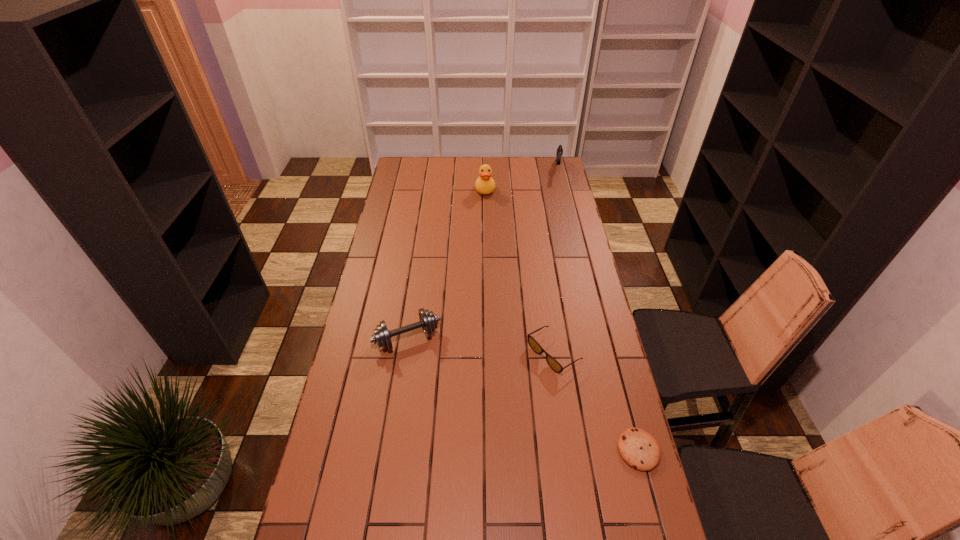
You are a GUI agent. You are given a task and a screenshot of the screen. Output one action in this format:
    pyautogui.click(x=<x>, y=<y>)
    Task: Click on the object that is at the far edge
    This screenshot has width=960, height=540.
    Given the screenshot: What is the action you would take?
    pyautogui.click(x=559, y=153)

Identify the location of object that is at the left edge. This screenshot has width=960, height=540. tap(428, 321).

Where is `cookie that is at the right edge`? Image resolution: width=960 pixels, height=540 pixels. cookie that is at the right edge is located at coordinates (639, 449).

Image resolution: width=960 pixels, height=540 pixels. Find the location of `sunglasses positioned at the right edge`. sunglasses positioned at the right edge is located at coordinates tap(553, 363).

Identify the location of gun located at the right edge. The width and height of the screenshot is (960, 540). (559, 153).

At what (x,y) coordinates should I click in order to perform the action: click on object at the far right corner. Please return your answer as a coordinate pair (x, y). Looking at the image, I should click on (559, 153).

Find the location of `free space at the far edge of the desktop`. free space at the far edge of the desktop is located at coordinates (530, 178).

In order to click on blank space at the left edge of the desktop in this screenshot , I will do `click(398, 287)`.

Find the location of a particular element. The width and height of the screenshot is (960, 540). blank area at the right edge is located at coordinates (559, 184).

Find the location of a particular element. This screenshot has height=540, width=960. free space at the far left corner of the desktop is located at coordinates [x=419, y=170].